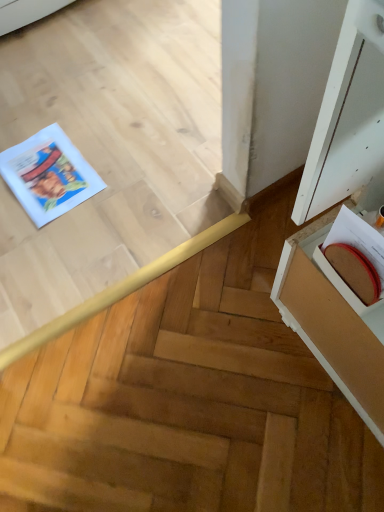
Question: From the image's perspective, is matte brown book at right located beneath white paper comic book at left?

Choices:
 (A) no
 (B) yes

Answer: (B)

Question: Is matte brown book at right oriented away from white paper comic book at left?

Choices:
 (A) no
 (B) yes

Answer: (A)

Question: Is matte brown book at right to the right of white paper comic book at left from the viewer's perspective?

Choices:
 (A) yes
 (B) no

Answer: (A)

Question: Considering the relative sizes of matte brown book at right and white paper comic book at left in the image provided, is matte brown book at right smaller than white paper comic book at left?

Choices:
 (A) yes
 (B) no

Answer: (A)

Question: Can you confirm if matte brown book at right is wider than white paper comic book at left?

Choices:
 (A) yes
 (B) no

Answer: (B)

Question: Is matte brown book at right bigger than white paper comic book at left?

Choices:
 (A) yes
 (B) no

Answer: (B)

Question: Would you say matte brown book at right contains white wood cabinet at right?

Choices:
 (A) no
 (B) yes

Answer: (A)

Question: From the image's perspective, is matte brown book at right beneath white wood cabinet at right?

Choices:
 (A) yes
 (B) no

Answer: (B)

Question: Is matte brown book at right facing away from white wood cabinet at right?

Choices:
 (A) no
 (B) yes

Answer: (B)

Question: From the image's perspective, is matte brown book at right located above white wood cabinet at right?

Choices:
 (A) yes
 (B) no

Answer: (A)

Question: Is matte brown book at right bigger than white wood cabinet at right?

Choices:
 (A) no
 (B) yes

Answer: (A)

Question: Does matte brown book at right appear on the right side of white wood cabinet at right?

Choices:
 (A) yes
 (B) no

Answer: (B)

Question: From the image's perspective, does white wood cabinet at right appear lower than white paper comic book at left?

Choices:
 (A) no
 (B) yes

Answer: (B)